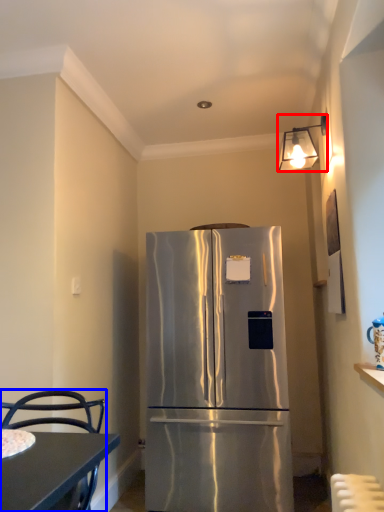
Question: Which object appears closest to the camera in this image, lamp (highlighted by a red box) or chair (highlighted by a blue box)?

Choices:
 (A) lamp
 (B) chair

Answer: (B)